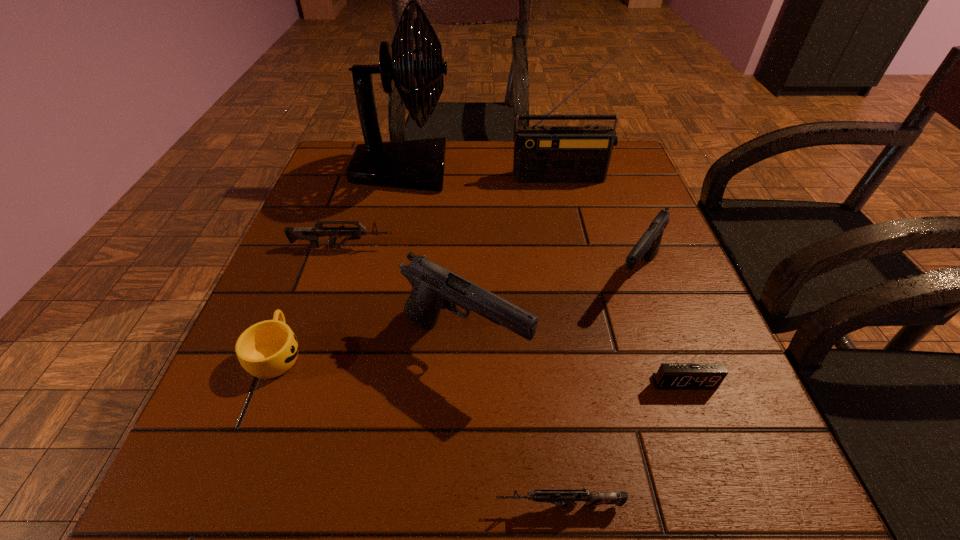
The height and width of the screenshot is (540, 960). What are the coordinates of `alarm clock that is positioned at the right edge` in the screenshot? It's located at (670, 376).

Locate an element on the screen. This screenshot has width=960, height=540. object at the far left corner is located at coordinates (416, 164).

This screenshot has height=540, width=960. In order to click on object situated at the far right corner in this screenshot , I will do `click(542, 154)`.

The image size is (960, 540). Identify the location of blank space at the far edge of the desktop. (465, 189).

At what (x,y) coordinates should I click in order to perform the action: click on vacant area at the near edge. Please return your answer as a coordinate pair (x, y). This screenshot has width=960, height=540. Looking at the image, I should click on (634, 493).

Identify the location of vacant area at the left edge. The image size is (960, 540). (191, 450).

In the image, there is a desktop. Identify the location of blank space at the right edge. The width and height of the screenshot is (960, 540). (635, 210).

In the image, there is a desktop. At what (x,y) coordinates should I click in order to perform the action: click on vacant space at the near left corner. Please return your answer as a coordinate pair (x, y). Looking at the image, I should click on (208, 453).

I want to click on free point at the near right corner, so click(x=663, y=468).

This screenshot has width=960, height=540. In order to click on free space between the nearer grey gun and the fan in this screenshot , I will do `click(481, 338)`.